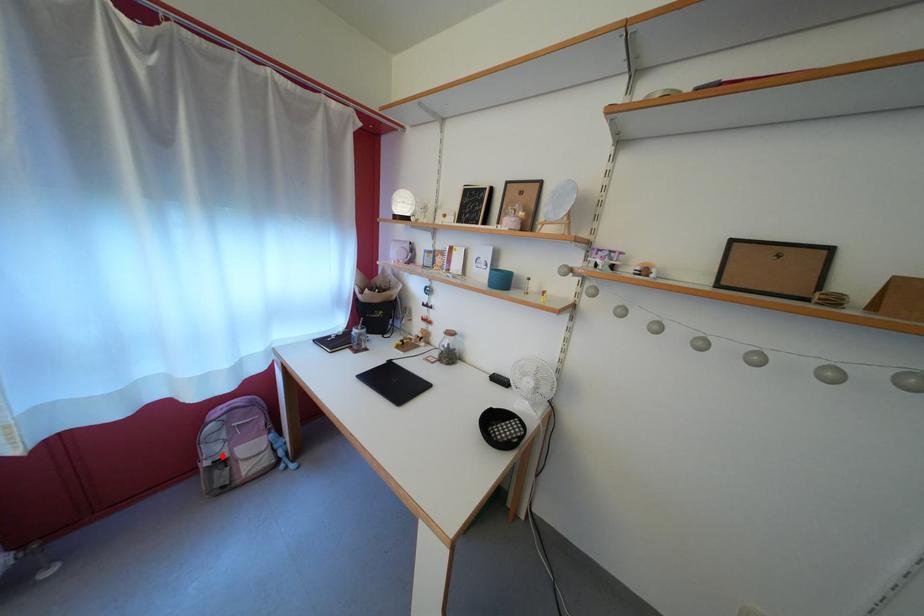
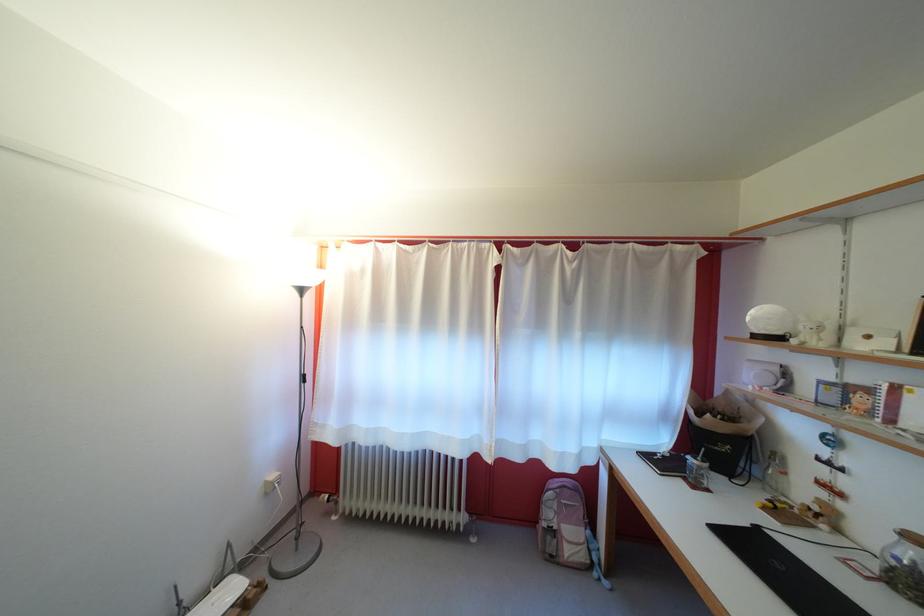
Question: I am providing you with two images of the same scene from different viewpoints. In image1, a red point is highlighted. Considering the same 3D point in image2, which of the following is correct?

Choices:
 (A) It is closer
 (B) It is farther

Answer: (B)